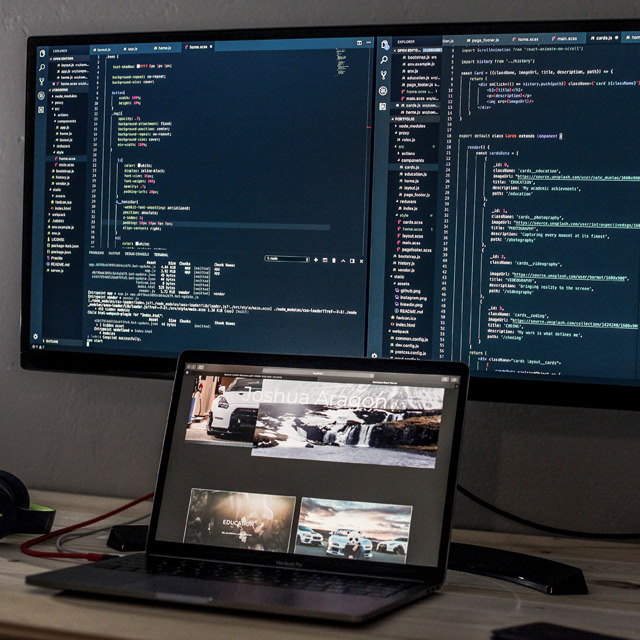
Where is `laptop`? This screenshot has width=640, height=640. laptop is located at coordinates (278, 493).